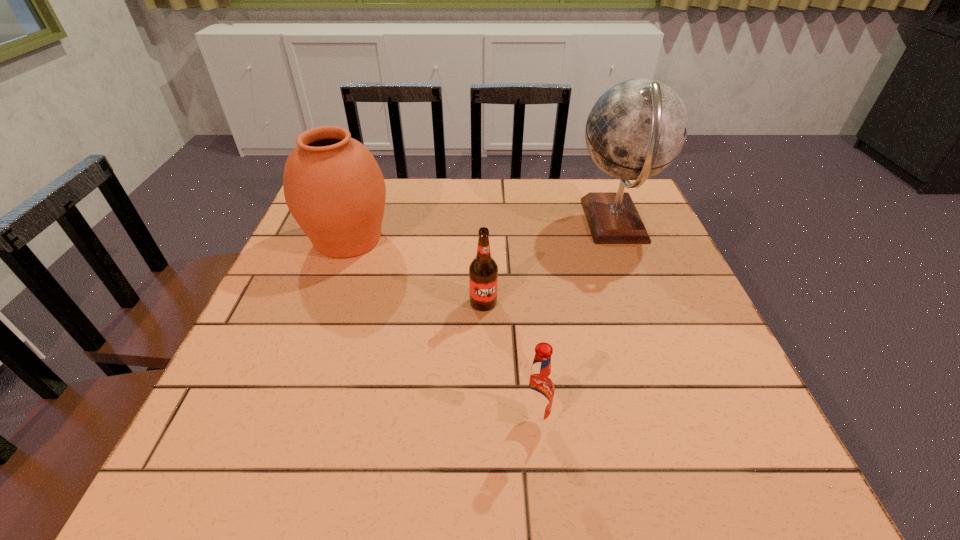
At what (x,y) coordinates should I click in order to perform the action: click on vacant region between the farther root beer and the leftmost object. Please return your answer as a coordinate pair (x, y). The width and height of the screenshot is (960, 540). Looking at the image, I should click on (416, 271).

Identify the location of vacant point located between the farther root beer and the globe. The image size is (960, 540). (549, 262).

The height and width of the screenshot is (540, 960). Find the location of `vacant point located between the second tallest object and the nearest object`. vacant point located between the second tallest object and the nearest object is located at coordinates (441, 329).

The image size is (960, 540). Find the location of `vacant space in between the right root beer and the second nearest object`. vacant space in between the right root beer and the second nearest object is located at coordinates (509, 361).

Select which object is the closest to the tallest object. Please provide its 2D coordinates. Your answer should be formatted as a tuple, i.e. [(x, y)], where the tuple contains the x and y coordinates of a point satisfying the conditions above.

[(483, 271)]

Select which object is the second closest to the second nearest object. Please provide its 2D coordinates. Your answer should be formatted as a tuple, i.e. [(x, y)], where the tuple contains the x and y coordinates of a point satisfying the conditions above.

[(538, 387)]

Locate an element on the screen. Image resolution: width=960 pixels, height=540 pixels. free space that satisfies the following two spatial constraints: 1. on the front side of the third shortest object; 2. on the left side of the right root beer is located at coordinates (282, 419).

The width and height of the screenshot is (960, 540). I want to click on free space that satisfies the following two spatial constraints: 1. on the front side of the second object from left to right; 2. on the left side of the urn, so click(x=324, y=302).

This screenshot has width=960, height=540. Find the location of `free space that satisfies the following two spatial constraints: 1. on the front side of the leftmost object; 2. on the right side of the right root beer`. free space that satisfies the following two spatial constraints: 1. on the front side of the leftmost object; 2. on the right side of the right root beer is located at coordinates (282, 419).

The width and height of the screenshot is (960, 540). Find the location of `free space that satisfies the following two spatial constraints: 1. on the front side of the urn; 2. on the right side of the second object from right to left`. free space that satisfies the following two spatial constraints: 1. on the front side of the urn; 2. on the right side of the second object from right to left is located at coordinates (282, 419).